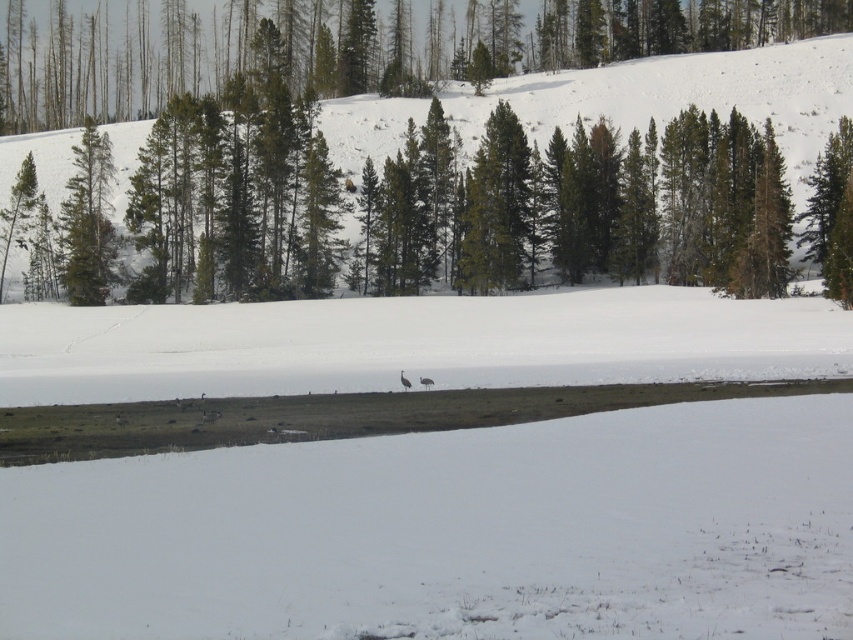
You are an ornithologist observing the winter landscape. You notice the green matte tree at upper center and the green matte trees at center. Which group of trees is taller?

The green matte trees at center are taller than the green matte tree at upper center.

You are standing in the snowy field and see the point marked at coordinates (111, 61). What object is located at this point?

The point at coordinates (111, 61) indicates a green matte tree at upper center.

You are standing in the winter landscape and want to move from the camera position to the point at coordinates point (392, 132). Which direction should you move relative to the point at coordinates point (302, 3)?

You should move away from the point at coordinates point (302, 3) because point (302, 3) is closer to the camera than point (392, 132). Moving away from point (302, 3) will take you towards point (392, 132).